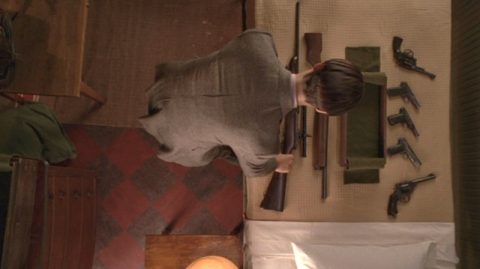
Find the location of a particular element. pillow is located at coordinates (355, 256).